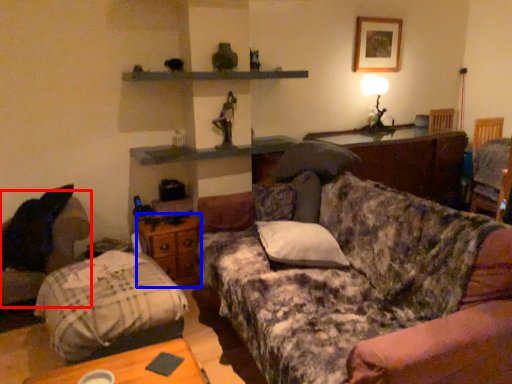
Question: Which object appears closest to the camera in this image, swivel chair (highlighted by a red box) or drawer (highlighted by a blue box)?

Choices:
 (A) swivel chair
 (B) drawer

Answer: (A)